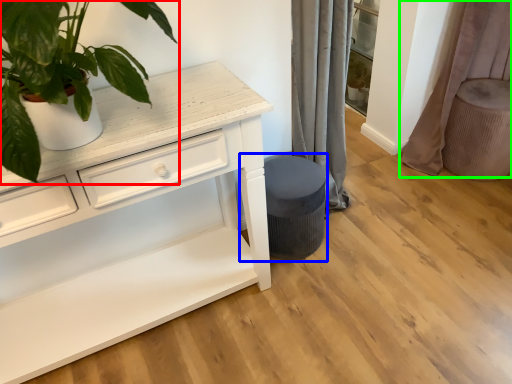
Question: Which object is the closest to the houseplant (highlighted by a red box)? Choose among these: music stool (highlighted by a blue box) or curtain (highlighted by a green box).

Choices:
 (A) music stool
 (B) curtain

Answer: (A)